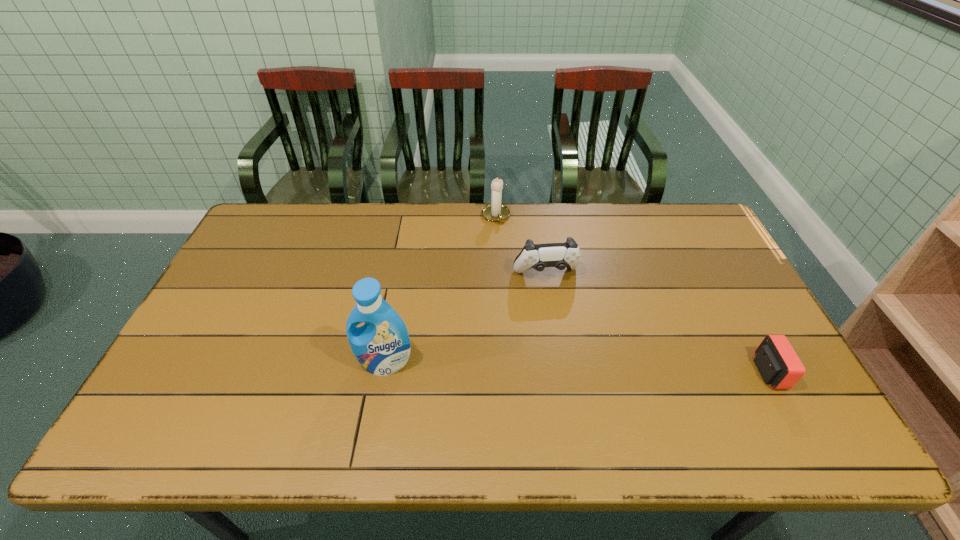
Where is `vacant space that satisfies the following two spatial constraints: 1. on the front side of the farthest object; 2. on the front-facing side of the shortest object`? The width and height of the screenshot is (960, 540). vacant space that satisfies the following two spatial constraints: 1. on the front side of the farthest object; 2. on the front-facing side of the shortest object is located at coordinates (502, 372).

Where is `vacant space that satisfies the following two spatial constraints: 1. on the front-facing side of the alarm clock; 2. on the front-facing side of the tallest object`? The width and height of the screenshot is (960, 540). vacant space that satisfies the following two spatial constraints: 1. on the front-facing side of the alarm clock; 2. on the front-facing side of the tallest object is located at coordinates (384, 372).

Find the location of a particular element. The width and height of the screenshot is (960, 540). free space that satisfies the following two spatial constraints: 1. on the front-facing side of the tallest object; 2. on the front-facing side of the shortest object is located at coordinates (384, 372).

This screenshot has height=540, width=960. Identify the location of blank space that satisfies the following two spatial constraints: 1. on the front-facing side of the detergent; 2. on the front-facing side of the shortest object. (384, 372).